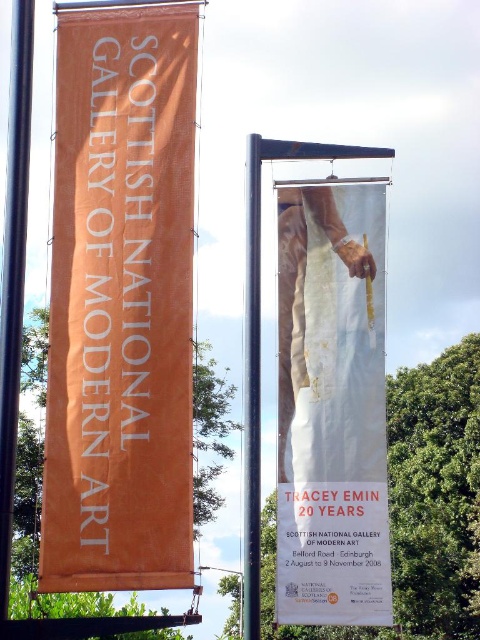
Who is higher up, orange fabric banner at left or white paper at center?

orange fabric banner at left is higher up.

Between point (84, 248) and point (348, 189), which one is positioned in front?

Point (84, 248) is in front.

You are a GUI agent. You are given a task and a screenshot of the screen. Output one action in this format:
    pyautogui.click(x=<x>, y=<y>)
    Task: Click on the orange fabric banner at left
    
    Given the screenshot: What is the action you would take?
    pyautogui.click(x=120, y=304)